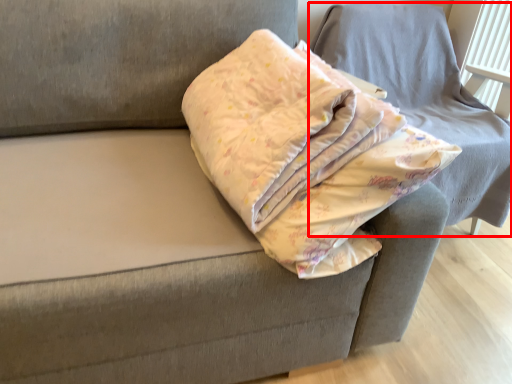
Question: Observing the image, what is the correct spatial positioning of furniture (annotated by the red box) in reference to throw pillow?

Choices:
 (A) right
 (B) left

Answer: (A)